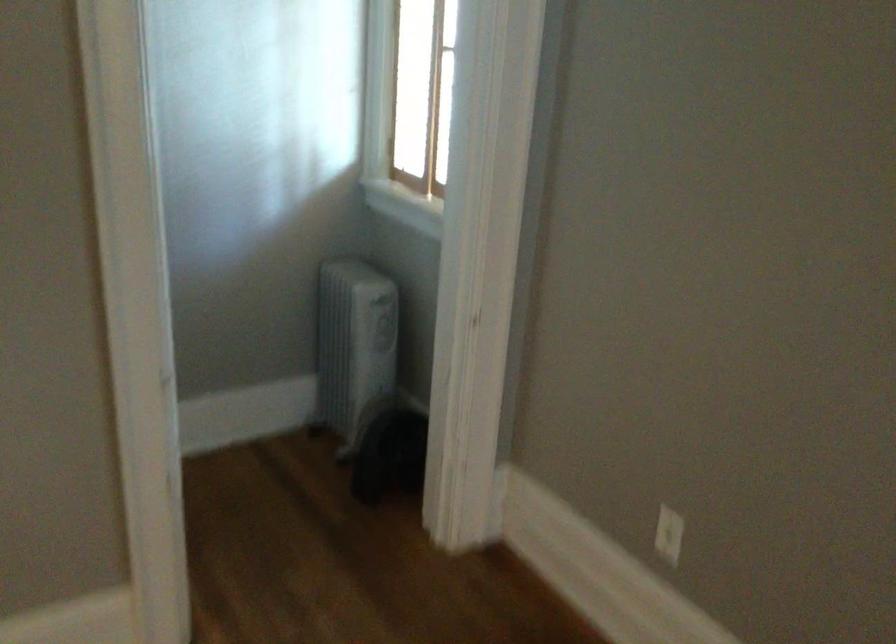
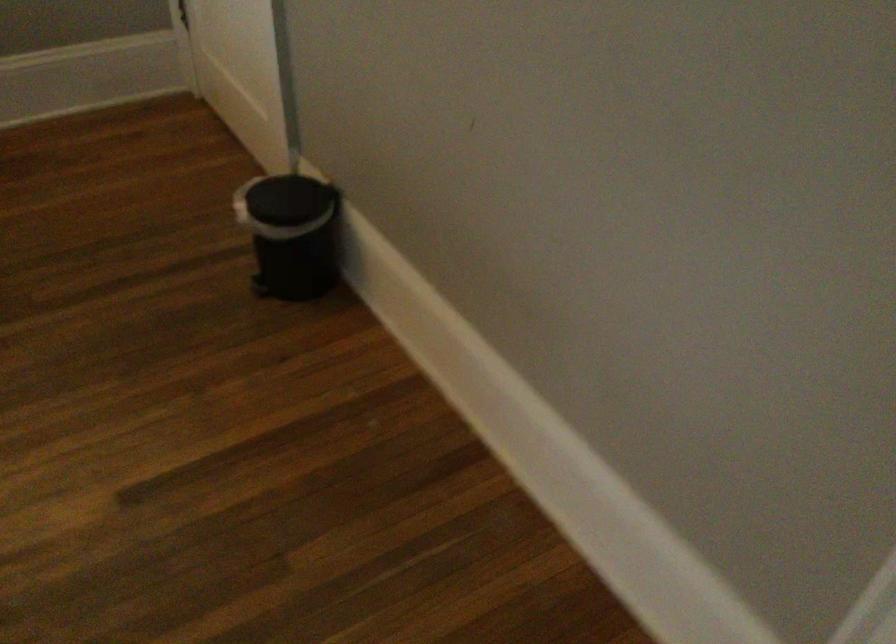
The images are taken continuously from a first-person perspective. In which direction is your viewpoint rotating?

The camera rotated toward left-down.